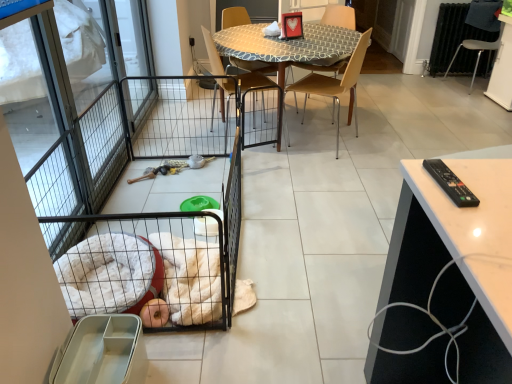
Question: Can you confirm if black wire pet cage at left is positioned to the right of wooden chair at center, positioned as the first chair in left-to-right order?

Choices:
 (A) yes
 (B) no

Answer: (B)

Question: Is black wire pet cage at left positioned beyond the bounds of wooden chair at center, positioned as the first chair in left-to-right order?

Choices:
 (A) yes
 (B) no

Answer: (A)

Question: From the image's perspective, is black wire pet cage at left on top of wooden chair at center, which is the fourth chair in right-to-left order?

Choices:
 (A) no
 (B) yes

Answer: (A)

Question: Does black wire pet cage at left have a smaller size compared to wooden chair at center, positioned as the first chair in left-to-right order?

Choices:
 (A) no
 (B) yes

Answer: (A)

Question: Is black wire pet cage at left far away from wooden chair at center, which is the fourth chair in right-to-left order?

Choices:
 (A) no
 (B) yes

Answer: (B)

Question: Does black wire pet cage at left lie behind wooden chair at center, which is the fourth chair in right-to-left order?

Choices:
 (A) no
 (B) yes

Answer: (A)

Question: From a real-world perspective, is metallic silver chair at right, positioned as the 4th chair in left-to-right order, on top of black wire pet cage at left?

Choices:
 (A) yes
 (B) no

Answer: (A)

Question: Are metallic silver chair at right, positioned as the 4th chair in left-to-right order, and black wire pet cage at left far apart?

Choices:
 (A) no
 (B) yes

Answer: (B)

Question: Is black wire pet cage at left surrounded by metallic silver chair at right, the first chair when ordered from right to left?

Choices:
 (A) no
 (B) yes

Answer: (A)

Question: From a real-world perspective, does metallic silver chair at right, positioned as the 4th chair in left-to-right order, sit lower than black wire pet cage at left?

Choices:
 (A) yes
 (B) no

Answer: (B)

Question: Can you confirm if metallic silver chair at right, positioned as the 4th chair in left-to-right order, is positioned to the right of black wire pet cage at left?

Choices:
 (A) yes
 (B) no

Answer: (A)

Question: Is metallic silver chair at right, the first chair when ordered from right to left, taller than black wire pet cage at left?

Choices:
 (A) no
 (B) yes

Answer: (B)

Question: Is wooden chair at center, positioned as the first chair in left-to-right order, oriented towards patterned fabric table at center?

Choices:
 (A) yes
 (B) no

Answer: (A)